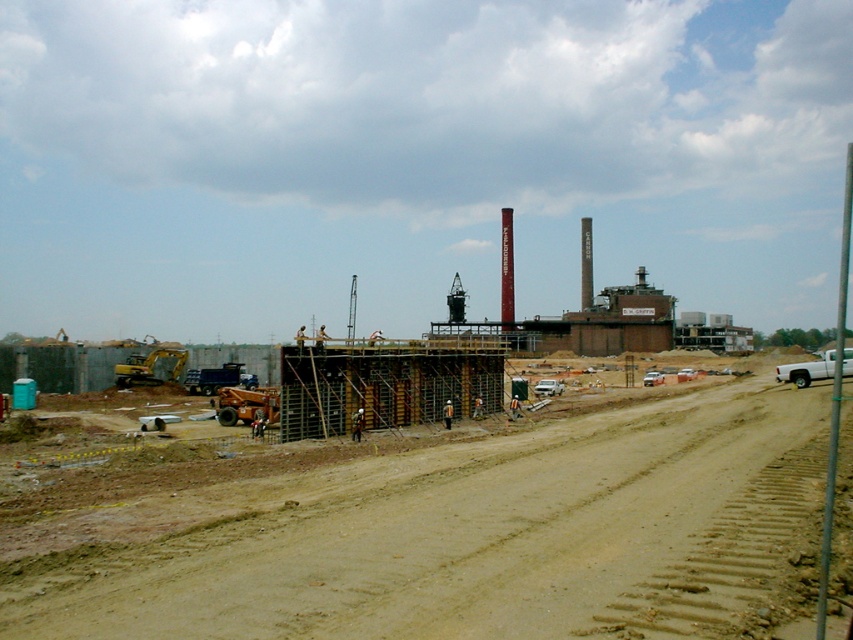
Question: Can you confirm if brown sandy dirt field at center is positioned to the left of yellow rubber excavator at center-left?

Choices:
 (A) yes
 (B) no

Answer: (B)

Question: Which object is farther from the camera taking this photo?

Choices:
 (A) brown sandy dirt field at center
 (B) yellow rubber excavator at center-left

Answer: (B)

Question: Among these points, which one is nearest to the camera?

Choices:
 (A) (125, 365)
 (B) (537, 552)

Answer: (B)

Question: Among these objects, which one is farthest from the camera?

Choices:
 (A) brown sandy dirt field at center
 (B) yellow rubber excavator at center-left

Answer: (B)

Question: Is brown sandy dirt field at center below yellow rubber excavator at center-left?

Choices:
 (A) no
 (B) yes

Answer: (A)

Question: Does brown sandy dirt field at center appear over yellow rubber excavator at center-left?

Choices:
 (A) yes
 (B) no

Answer: (A)